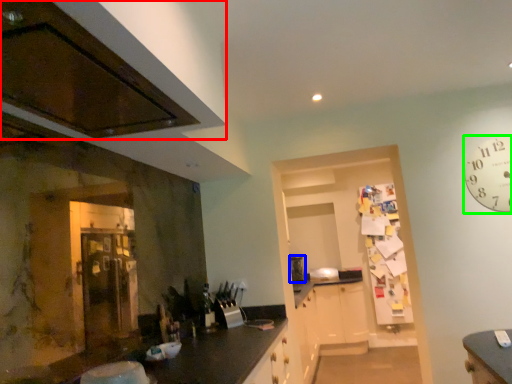
Question: Considering the real-world distances, which object is farthest from cabinetry (highlighted by a red box)? appliance (highlighted by a blue box) or clock (highlighted by a green box)?

Choices:
 (A) appliance
 (B) clock

Answer: (A)